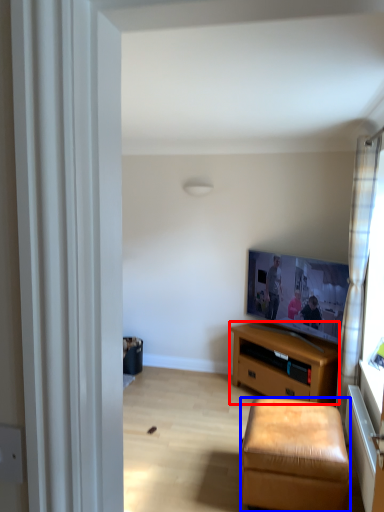
Question: Among these objects, which one is nearest to the camera, desk (highlighted by a red box) or stool (highlighted by a blue box)?

Choices:
 (A) desk
 (B) stool

Answer: (B)